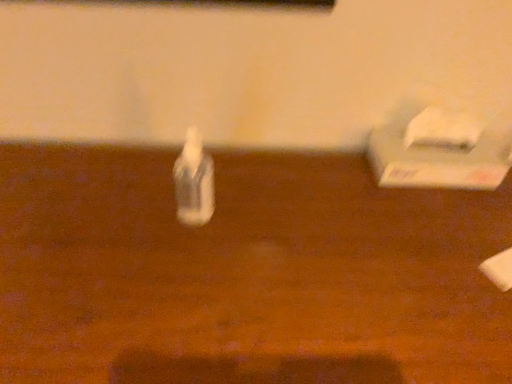
Where is `vacant area that is in front of white matte tissue box at right`? vacant area that is in front of white matte tissue box at right is located at coordinates (434, 233).